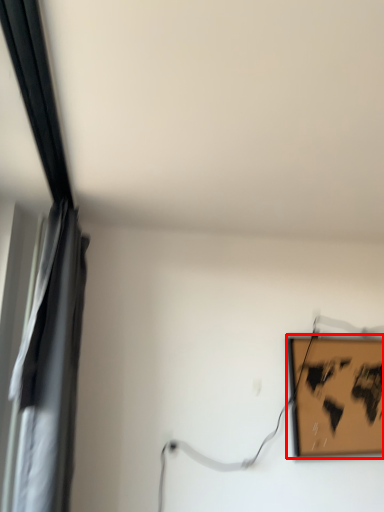
Question: Considering the relative positions of picture frame (annotated by the red box) and curtain in the image provided, where is picture frame (annotated by the red box) located with respect to the staircase?

Choices:
 (A) right
 (B) left

Answer: (A)